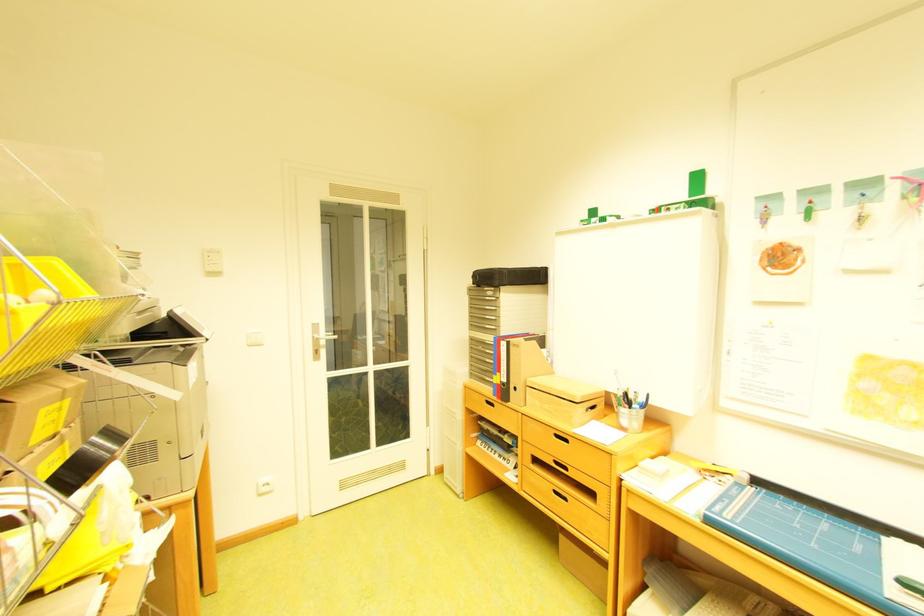
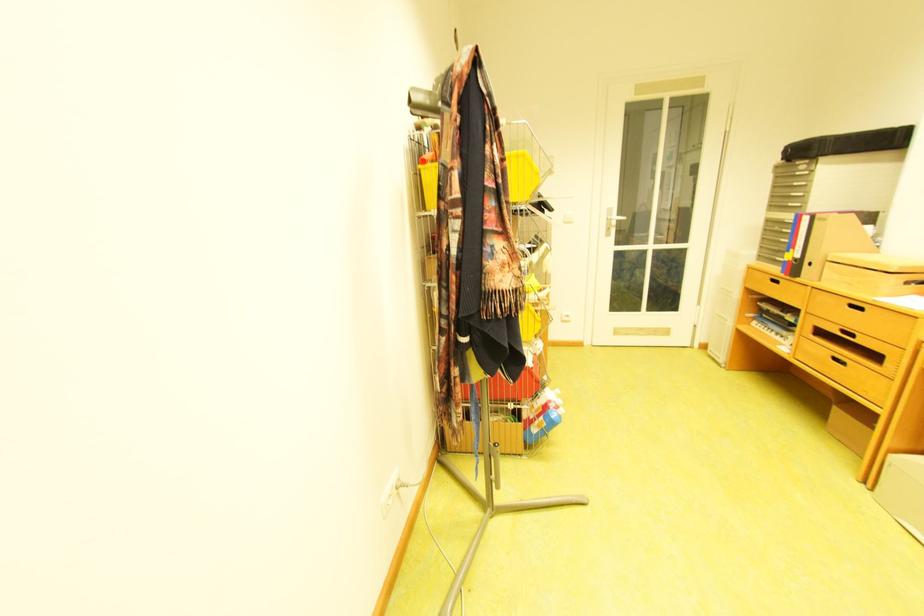
Find the pixel in the second image that matches point (566, 493) in the first image.

(845, 360)